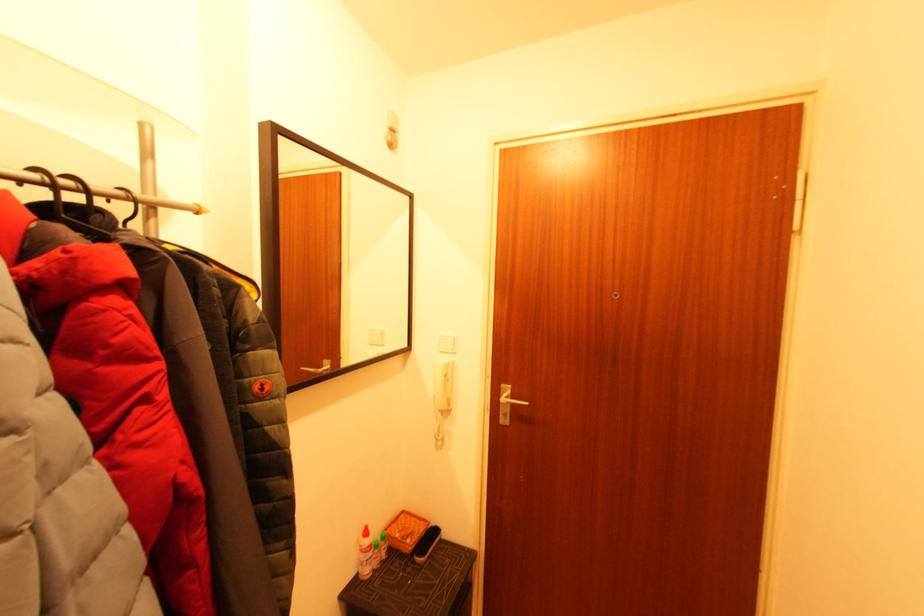
Describe the element at coordinates (446, 342) in the screenshot. I see `the white light switch` at that location.